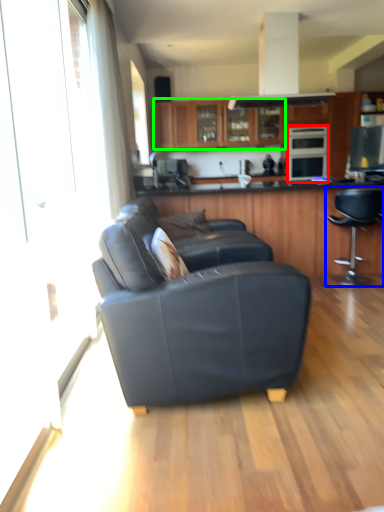
Question: Which object is positioned farthest from appliance (highlighted by a red box)? Select from chair (highlighted by a blue box) and cabinetry (highlighted by a green box).

Choices:
 (A) chair
 (B) cabinetry

Answer: (A)